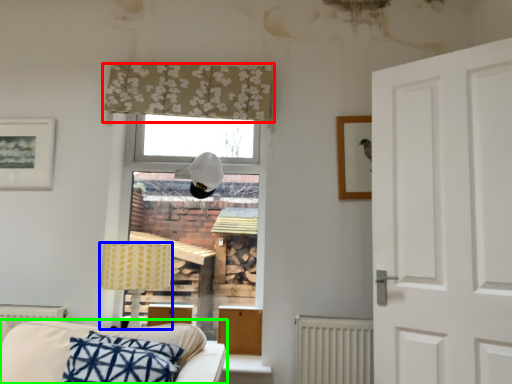
Question: Which object is positioned closest to curtain (highlighted by a red box)? Select from table lamp (highlighted by a blue box) and studio couch (highlighted by a green box).

Choices:
 (A) table lamp
 (B) studio couch

Answer: (A)